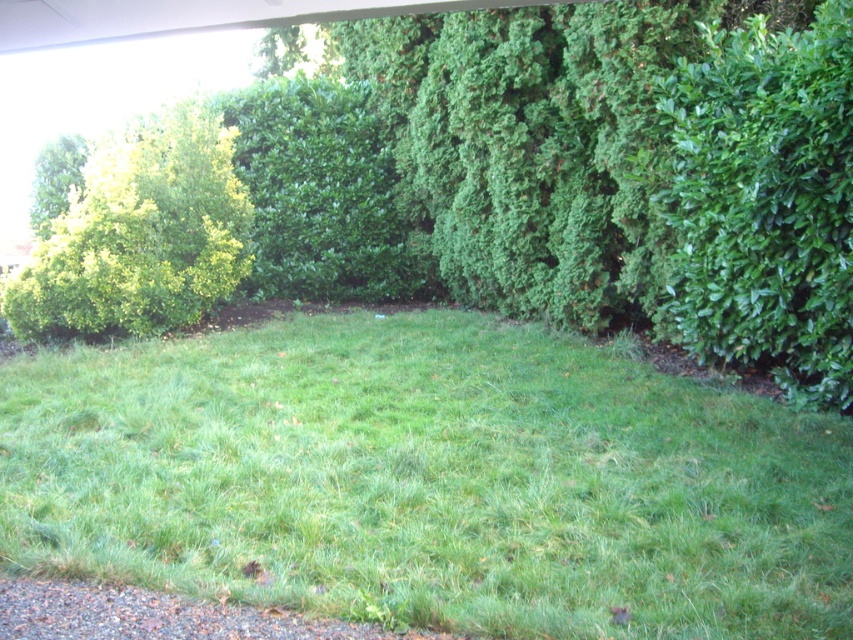
Between green grassy area at center and green leafy bush at left, which one has less height?

Standing shorter between the two is green grassy area at center.

This screenshot has height=640, width=853. I want to click on green grassy area at center, so click(428, 480).

Identify the location of green grassy area at center. This screenshot has height=640, width=853. (428, 480).

Looking at this image, is green leafy bush at center to the right of green leafy tree at upper left from the viewer's perspective?

Correct, you'll find green leafy bush at center to the right of green leafy tree at upper left.

The image size is (853, 640). I want to click on green leafy bush at center, so click(321, 195).

Which is behind, point (358, 154) or point (44, 170)?

The point (358, 154) is more distant.

Locate an element on the screen. green leafy bush at center is located at coordinates click(321, 195).

Is green grassy area at center taller than green leafy bush at center?

No, green grassy area at center is not taller than green leafy bush at center.

Between green grassy area at center and green leafy bush at center, which one has less height?

green grassy area at center is shorter.

The width and height of the screenshot is (853, 640). I want to click on green grassy area at center, so tap(428, 480).

This screenshot has height=640, width=853. What are the coordinates of `green grassy area at center` in the screenshot? It's located at (428, 480).